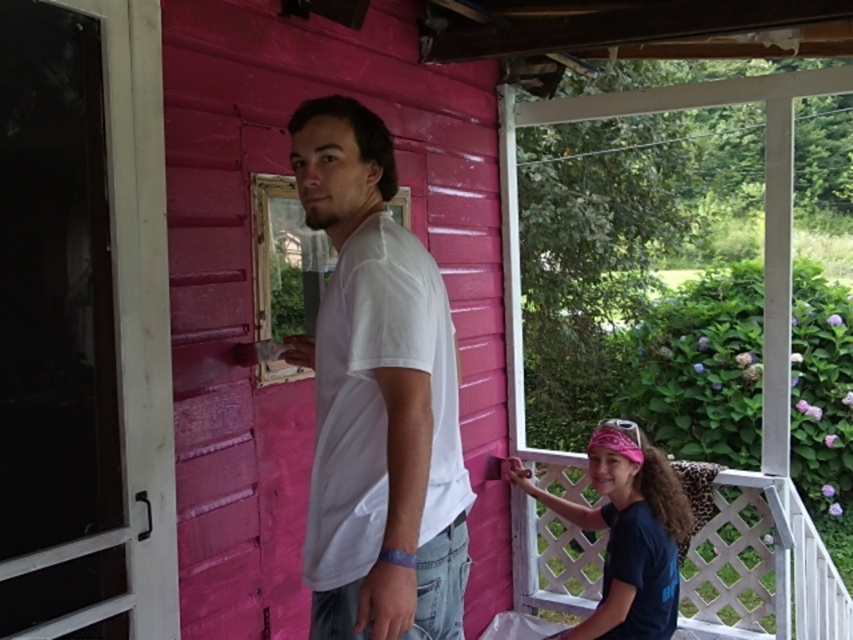
Question: From the image, what is the correct spatial relationship of white matte t-shirt at center in relation to pink fabric headband at lower right?

Choices:
 (A) left
 (B) right

Answer: (A)

Question: Among these objects, which one is nearest to the camera?

Choices:
 (A) white matte t-shirt at center
 (B) pink fabric headband at lower right

Answer: (A)

Question: Does white matte t-shirt at center appear over pink fabric headband at lower right?

Choices:
 (A) yes
 (B) no

Answer: (A)

Question: Which point is closer to the camera?

Choices:
 (A) pink fabric headband at lower right
 (B) white matte t-shirt at center

Answer: (B)

Question: Is white matte t-shirt at center to the right of pink fabric headband at lower right from the viewer's perspective?

Choices:
 (A) no
 (B) yes

Answer: (A)